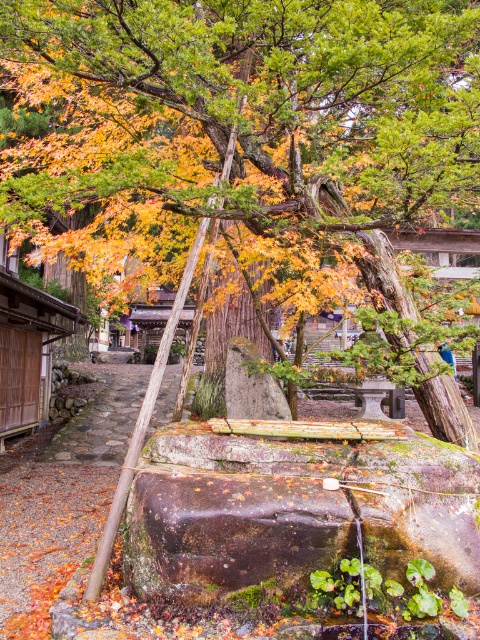
You are a visitor walking towards the stone structure in the scene. As you approach, you notice the autumn leaves at center and the brown stone path at center. Which object will you encounter first?

The autumn leaves at center will be encountered first since they are positioned in front of the brown stone path at center from the viewer perspective.

You are standing at the base of the large tree in the autumnal scene. There are two points marked in the image, one at coordinates point (x=207, y=134) and another at point (x=91, y=420). Which point is nearer to your current position?

Point (x=207, y=134) is closer to the camera than point (x=91, y=420), so the point at coordinates point (x=207, y=134) is nearer to your current position.